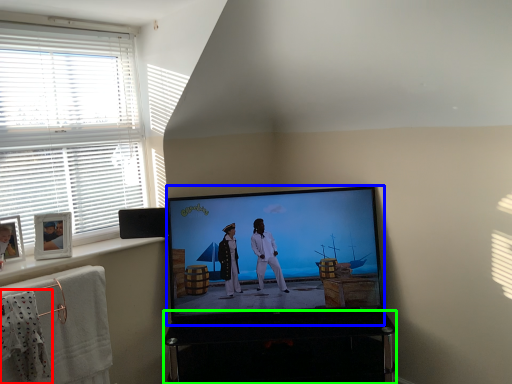
Question: Considering the real-world distances, which object is closest to laundry (highlighted by a red box)? television (highlighted by a blue box) or furniture (highlighted by a green box).

Choices:
 (A) television
 (B) furniture

Answer: (B)